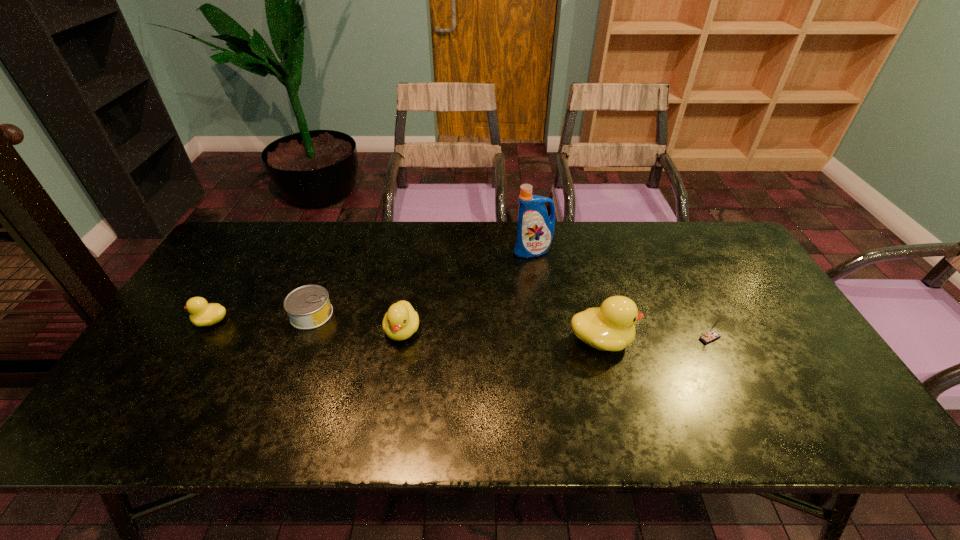
This screenshot has height=540, width=960. In the image, there is a desktop. Find the location of `vacant space at the near edge`. vacant space at the near edge is located at coordinates (373, 400).

The width and height of the screenshot is (960, 540). Find the location of `vacant area at the right edge`. vacant area at the right edge is located at coordinates (771, 318).

Find the location of a particular element. free spot at the far left corner of the desktop is located at coordinates (241, 259).

The width and height of the screenshot is (960, 540). In the image, there is a desktop. In order to click on vacant space at the far right corner in this screenshot , I will do `click(694, 254)`.

At what (x,y) coordinates should I click in order to perform the action: click on free space between the second duckling from left to right and the rightmost duckling. Please return your answer as a coordinate pair (x, y). This screenshot has width=960, height=540. Looking at the image, I should click on (502, 335).

Image resolution: width=960 pixels, height=540 pixels. Find the location of `blank region between the second shortest object and the shortest object`. blank region between the second shortest object and the shortest object is located at coordinates (261, 318).

You are a GUI agent. You are given a task and a screenshot of the screen. Output one action in this format:
    pyautogui.click(x=<x>, y=<y>)
    Task: Click on the vacant space that's between the detergent and the fourth object from right to left
    
    Given the screenshot: What is the action you would take?
    pyautogui.click(x=468, y=291)

At what (x,y) coordinates should I click in order to perform the action: click on free area in between the shortest object and the matchbox. Please return your answer as a coordinate pair (x, y). The height and width of the screenshot is (540, 960). Looking at the image, I should click on (511, 326).

This screenshot has height=540, width=960. In order to click on vacant region between the second duckling from left to right and the fifth object from right to left in this screenshot , I will do `click(357, 322)`.

In order to click on free space between the shortest duckling and the rightmost object in this screenshot , I will do `click(461, 329)`.